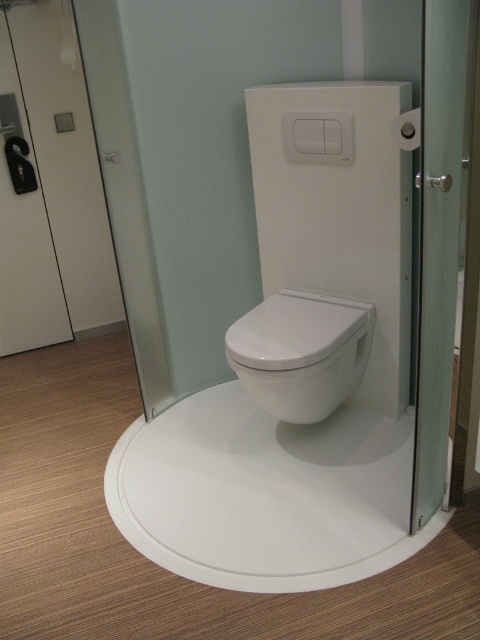
You are a contractor measuring bathroom fixtures. You need to install a new toilet seat and a screen door. Given the current setup, which object, the white glossy toilet seat at center or the transparent glass screen door at right, has a bigger physical size?

The white glossy toilet seat at center has a larger size compared to the transparent glass screen door at right.

You are standing in the bathroom and want to reach both the toilet and the door handle. The toilet is located at point (459, 140) and the door handle is at point (315, 376). Which point should you approach first to reach the closer one?

Point (459, 140) is closer to the viewer than point (315, 376), so you should approach the toilet first.